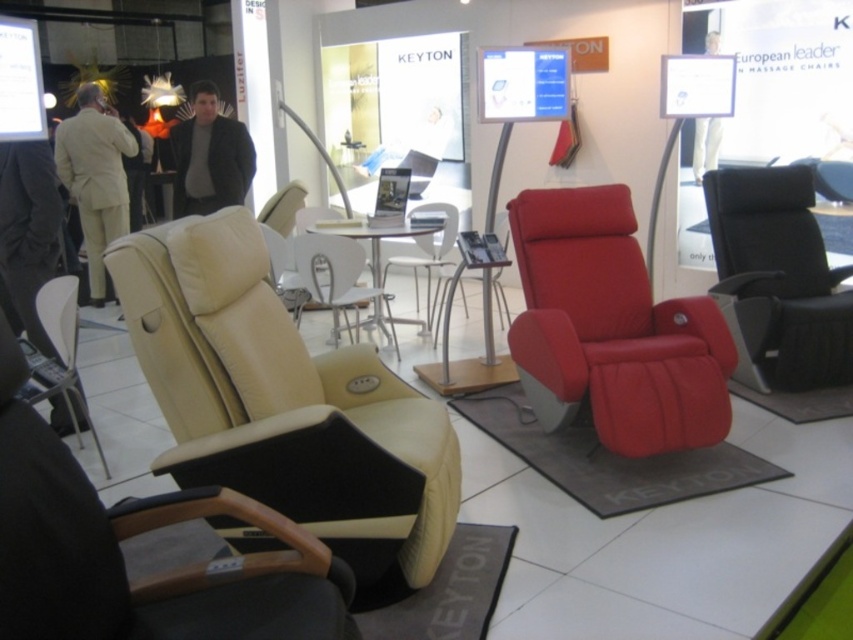
Who is more distant from viewer, (573,348) or (805,364)?

The point (805,364) is more distant.

Does point (698, 332) lie behind point (746, 253)?

No, it is in front of (746, 253).

Where is `matte red swivel chair at center`? Image resolution: width=853 pixels, height=640 pixels. matte red swivel chair at center is located at coordinates (614, 324).

Which is above, beige leather armchair at left or matte red swivel chair at center?

matte red swivel chair at center is higher up.

The width and height of the screenshot is (853, 640). I want to click on beige leather armchair at left, so click(285, 403).

Between point (325, 378) and point (677, 324), which one is positioned in front?

Point (325, 378)

Image resolution: width=853 pixels, height=640 pixels. In order to click on beige leather armchair at left in this screenshot , I will do `click(285, 403)`.

Which is more to the left, beige leather armchair at left or beige leather chair at center?

beige leather armchair at left

Is point (224, 406) positioned behind point (383, 269)?

No, it is in front of (383, 269).

Locate an element on the screen. beige leather armchair at left is located at coordinates (285, 403).

Identify the location of beige leather armchair at left. (285, 403).